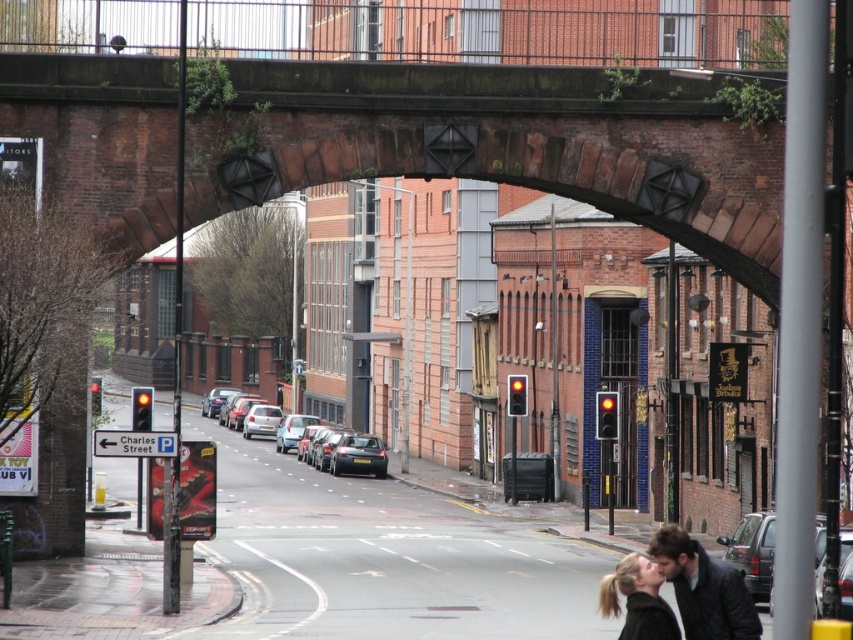
Question: Which of the following is the closest to the observer?

Choices:
 (A) dark brown leather jacket at lower right
 (B) brick archway at center

Answer: (B)

Question: Does brick archway at center appear under dark brown leather jacket at lower right?

Choices:
 (A) yes
 (B) no

Answer: (B)

Question: Among these objects, which one is farthest from the camera?

Choices:
 (A) black hair at lower right
 (B) dark brown leather jacket at lower right

Answer: (B)

Question: Does dark brown leather jacket at lower right have a smaller size compared to black hair at lower right?

Choices:
 (A) no
 (B) yes

Answer: (A)

Question: Which object is closer to the camera taking this photo?

Choices:
 (A) brick archway at center
 (B) black hair at lower right

Answer: (A)

Question: Is brick archway at center further to the viewer compared to black hair at lower right?

Choices:
 (A) no
 (B) yes

Answer: (A)